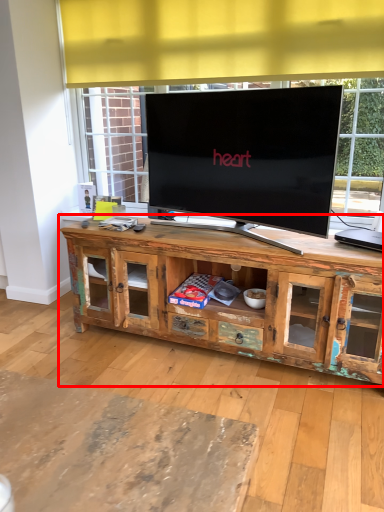
Question: Where is cabinetry (annotated by the red box) located in relation to computer in the image?

Choices:
 (A) left
 (B) right

Answer: (A)